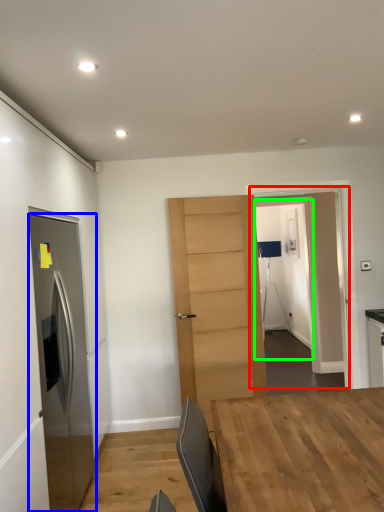
Question: Which object is the farthest from glass door (highlighted by a red box)? Choose among these: door (highlighted by a blue box) or glass door (highlighted by a green box).

Choices:
 (A) door
 (B) glass door

Answer: (A)